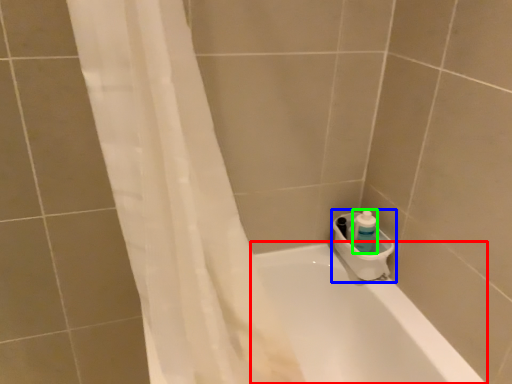
Question: Which object is the closest to the bathtub (highlighted by a red box)? Choose among these: sink (highlighted by a blue box) or cleaning product (highlighted by a green box).

Choices:
 (A) sink
 (B) cleaning product

Answer: (A)